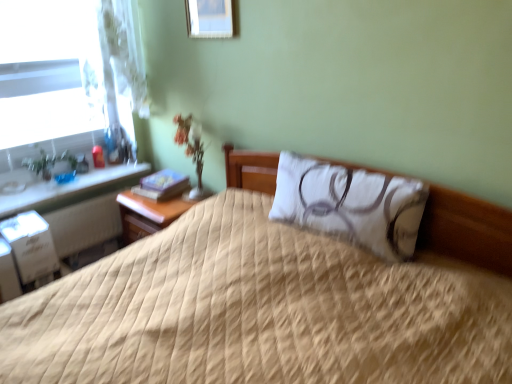
Question: Is point (193, 279) positioned closer to the camera than point (29, 225)?

Choices:
 (A) closer
 (B) farther

Answer: (A)

Question: From a real-world perspective, is beige quilted bed at center physically located above or below white cardboard file cabinet at lower left?

Choices:
 (A) above
 (B) below

Answer: (A)

Question: Considering the real-world distances, which object is closest to the green glossy plant at left?

Choices:
 (A) wooden picture frame at upper center
 (B) white quilted pillow at center
 (C) white glossy window sill at left
 (D) clear glass window at left
 (E) beige quilted bed at center

Answer: (C)

Question: Which object is the farthest from the white quilted pillow at center?

Choices:
 (A) beige quilted bed at center
 (B) clear glass window at left
 (C) green glossy plant at left
 (D) white glossy window sill at left
 (E) white cardboard file cabinet at lower left

Answer: (C)